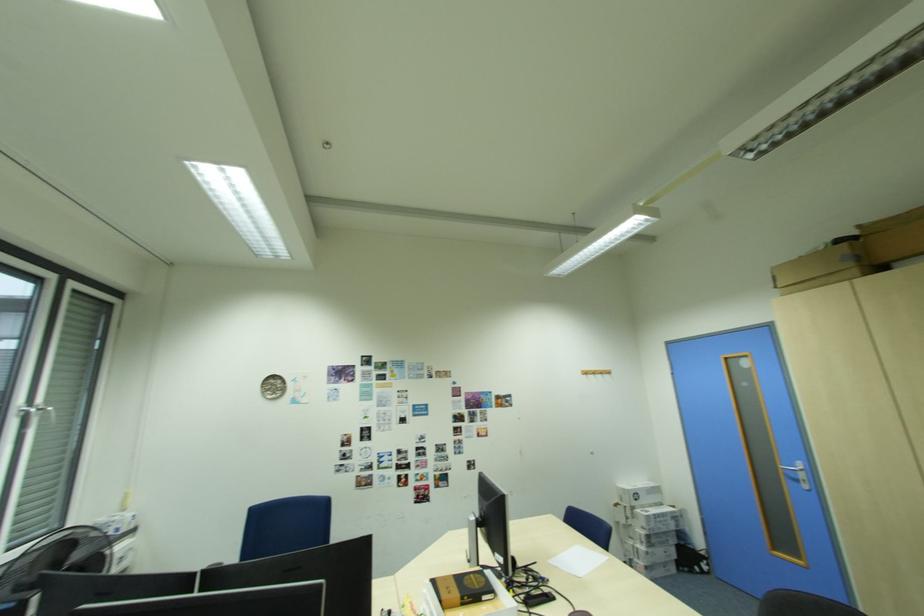
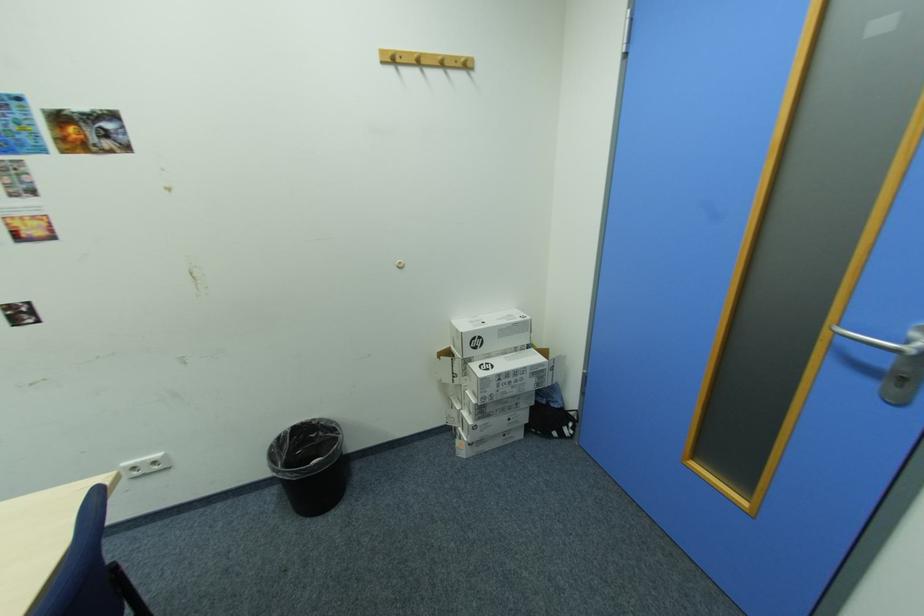
Locate, in the second image, the point that corresponds to point 650,533 in the first image.

(481, 400)